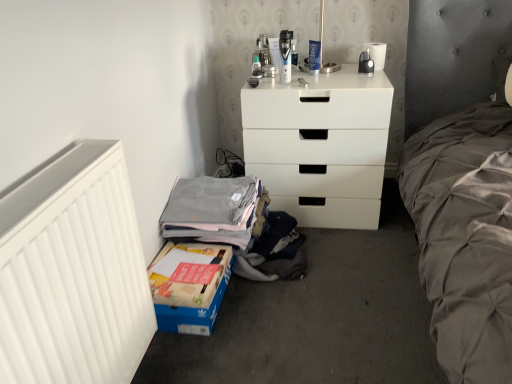
The image size is (512, 384). What are the coordinates of `vacant area in front of blue cardboard box at lower left` in the screenshot? It's located at (205, 354).